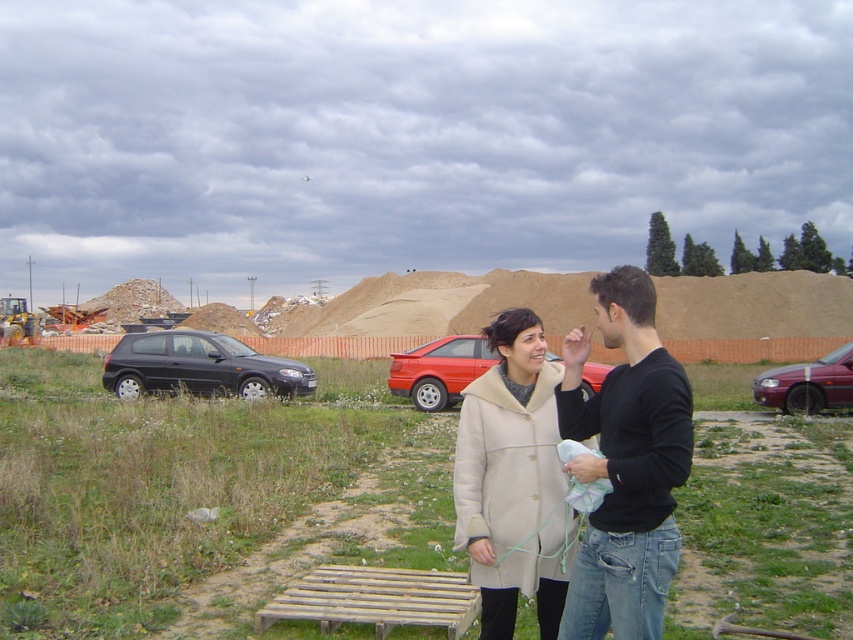
You are a photographer trying to capture a portrait of both the black cotton shirt at center and the beige wool coat at center. Since you want to ensure both subjects are fully visible in the frame, which subject should you position closer to the camera to avoid cropping?

The black cotton shirt at center might be wider than the beige wool coat at center, so positioning the black cotton shirt at center closer to the camera would allow it to occupy more space in the frame while keeping the beige wool coat at center visible.

From the picture: You are planning to sit down on the wooden bench at center and the matte black hatchback at left. Which object can you sit on?

The wooden bench at center is larger in size compared to the matte black hatchback at left, so you can sit on the wooden bench at center.

You are a photographer trying to capture a photo of the matte black hatchback at left without including the black cotton shirt at center in the frame. Based on their positions, is this possible?

The black cotton shirt at center is above the matte black hatchback at left, so if you position your camera to aim below the shirt, you can capture the hatchback without the shirt in the frame.